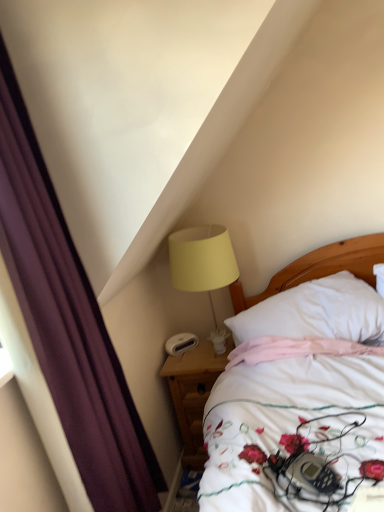
Locate an element on the screen. free space on the front side of white plastic alarm clock at lower center is located at coordinates (182, 359).